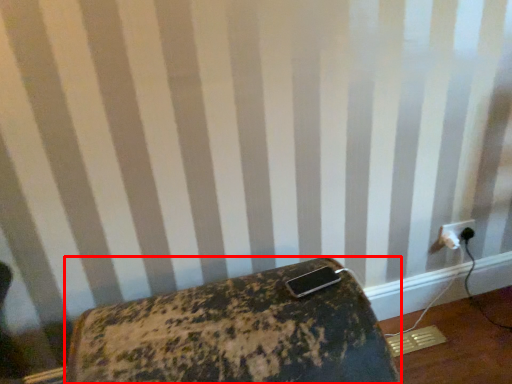
Question: In this image, where is furniture (annotated by the red box) located relative to power plugs and sockets?

Choices:
 (A) left
 (B) right

Answer: (A)